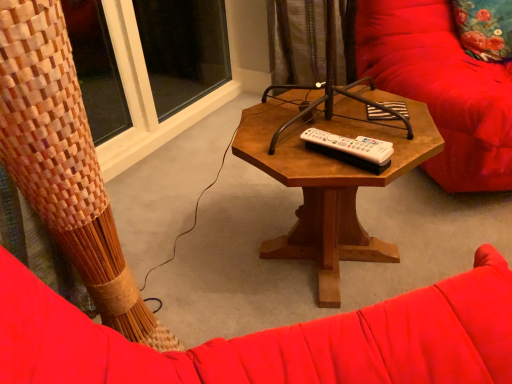
The image size is (512, 384). Identify the location of vacant space that is to the left of white plastic remote at center. (287, 152).